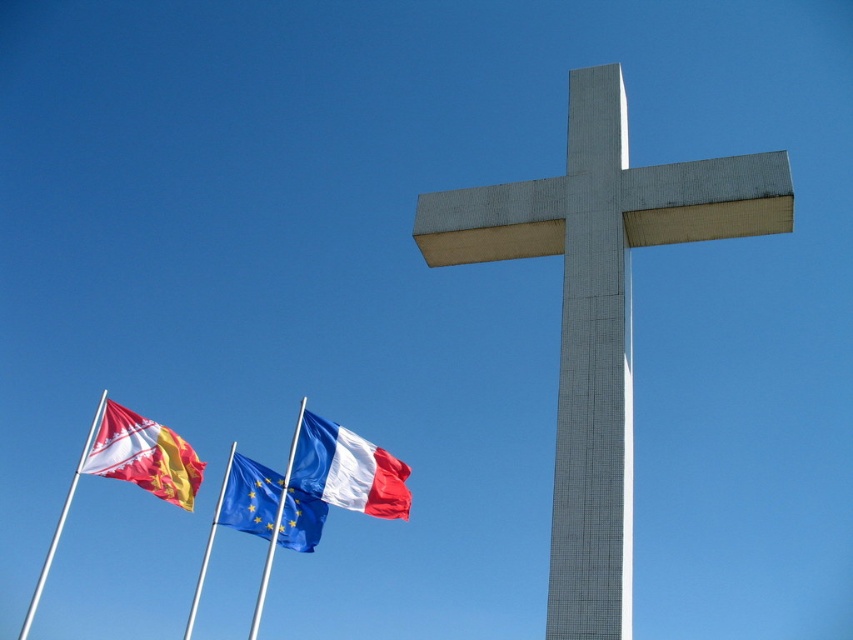
Question: Is white and blue fabric flag at center smaller than metallic silver flag pole at lower left?

Choices:
 (A) yes
 (B) no

Answer: (A)

Question: Is blue fabric flag pole at center closer to the viewer compared to metallic silver flag pole at lower left?

Choices:
 (A) yes
 (B) no

Answer: (A)

Question: Among these objects, which one is nearest to the camera?

Choices:
 (A) metallic silver flag pole at lower left
 (B) red and gold fabric flag at left
 (C) white textured cross at center

Answer: (C)

Question: Is white and blue fabric flag at center closer to the viewer compared to blue fabric flag at center?

Choices:
 (A) no
 (B) yes

Answer: (A)

Question: Which of the following is the farthest from the observer?

Choices:
 (A) blue fabric flag pole at center
 (B) red and gold fabric flag at left

Answer: (B)

Question: Based on their relative distances, which object is nearer to the metallic silver flag pole at lower left?

Choices:
 (A) white and blue fabric flag at center
 (B) red and gold fabric flag at left
 (C) blue fabric flag pole at center

Answer: (C)